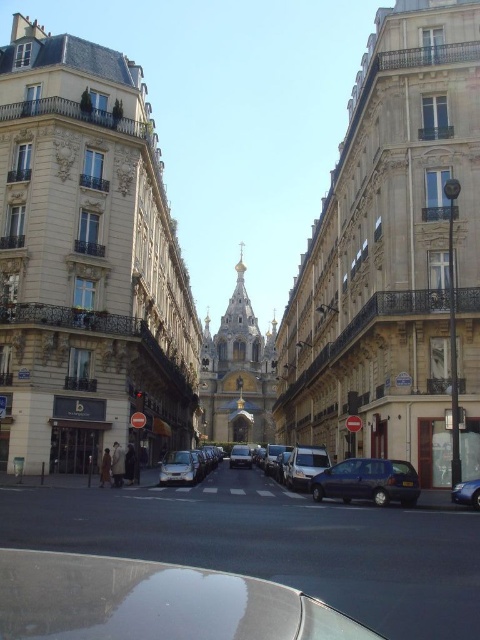
You are driving a delivery van that is 2 meters wide and need to park in the street. You see a dark blue metallic car at center and a metallic silver van at center. Which vehicle takes up more space on the road?

The dark blue metallic car at center has a larger width than the metallic silver van at center, so it takes up more space on the road.

You are a delivery driver who needs to park your vehicle in this street. Your van is 10 meters long. You see the satin silver car at center and the silver metallic van at center. Can you safely park your van between them without overlapping either vehicle?

The satin silver car at center is 33.88 meters from the silver metallic van at center. Since your van is only 10 meters long, there is enough space between them to park safely without overlapping either vehicle.

You are a pedestrian standing at the end of the street facing the grand church. You see a satin silver car at center and a silver metallic van at center. Which vehicle is positioned higher in the image?

The satin silver car at center is positioned higher than the silver metallic van at center in the image.